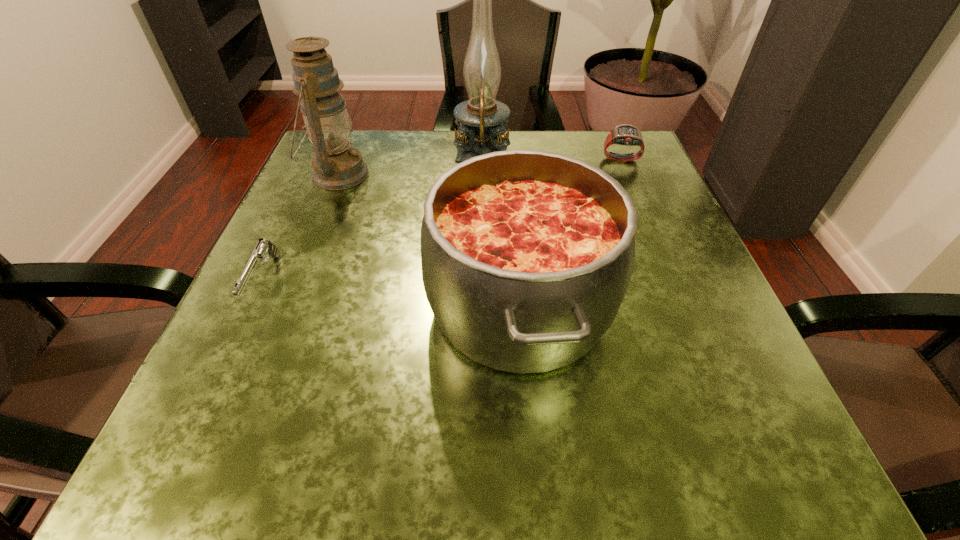
Find the location of a particular element. The image size is (960, 540). free space located on the left of the rightmost object is located at coordinates (430, 160).

The width and height of the screenshot is (960, 540). I want to click on vacant space located 0.140m on the front-facing side of the shortest object, so click(x=209, y=399).

This screenshot has width=960, height=540. Identify the location of watch that is at the far edge. (625, 134).

This screenshot has width=960, height=540. I want to click on object that is at the near edge, so click(x=526, y=255).

The width and height of the screenshot is (960, 540). Identify the location of oil lamp present at the left edge. (336, 166).

Locate an element on the screen. The image size is (960, 540). pistol that is positioned at the left edge is located at coordinates (263, 249).

This screenshot has width=960, height=540. Find the location of `object situated at the right edge`. object situated at the right edge is located at coordinates coord(625,134).

Identify the location of object that is positioned at the far left corner. (336, 166).

Locate an element on the screen. This screenshot has height=540, width=960. object that is at the far right corner is located at coordinates (625, 134).

Where is `free space at the far edge`? The image size is (960, 540). free space at the far edge is located at coordinates (392, 152).